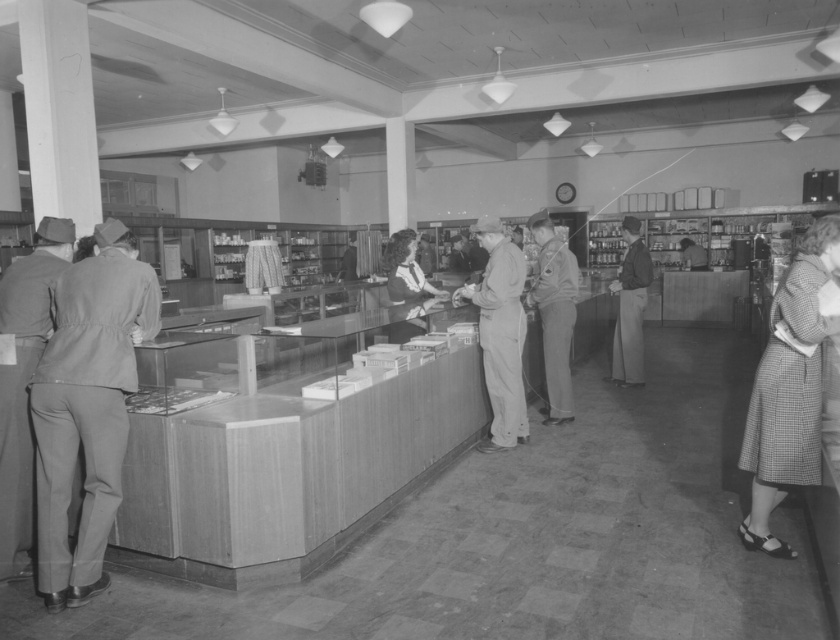
Question: Which object is the farthest from the smooth gray suit at left?

Choices:
 (A) checkered fabric skirt at lower right
 (B) matte khaki uniform at left

Answer: (A)

Question: Which object is the farthest from the uniformed man at center?

Choices:
 (A) smooth leather jacket at center
 (B) smooth gray suit at left

Answer: (A)

Question: In this image, where is smooth gray suit at left located relative to checkered fabric skirt at lower right?

Choices:
 (A) right
 (B) left

Answer: (B)

Question: Which of the following is the closest to the observer?

Choices:
 (A) curly-haired woman at center
 (B) matte gray jumpsuit at center

Answer: (A)

Question: Can you confirm if uniformed man at center is wider than smooth leather jacket at center?

Choices:
 (A) no
 (B) yes

Answer: (B)

Question: Can you confirm if smooth gray suit at left is wider than matte khaki uniform at left?

Choices:
 (A) no
 (B) yes

Answer: (B)